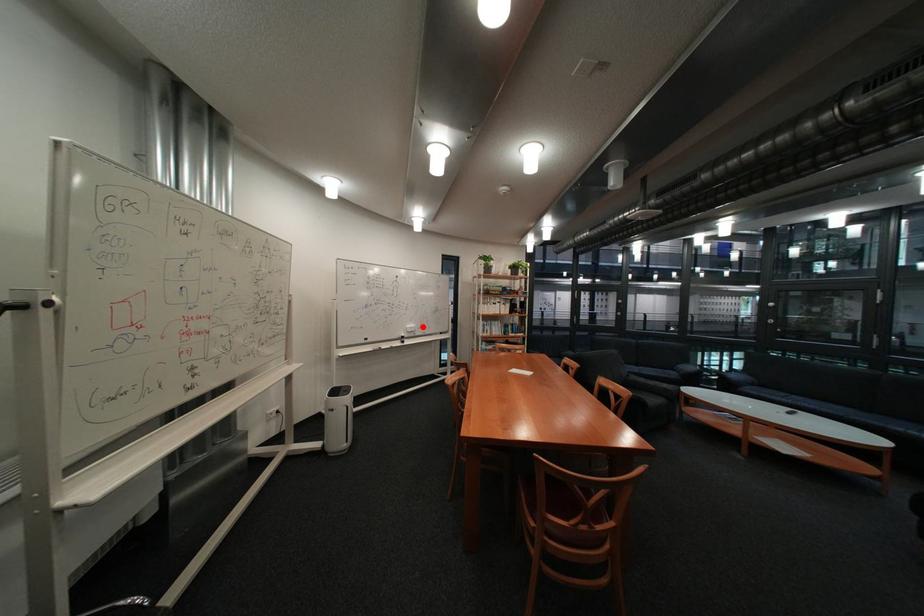
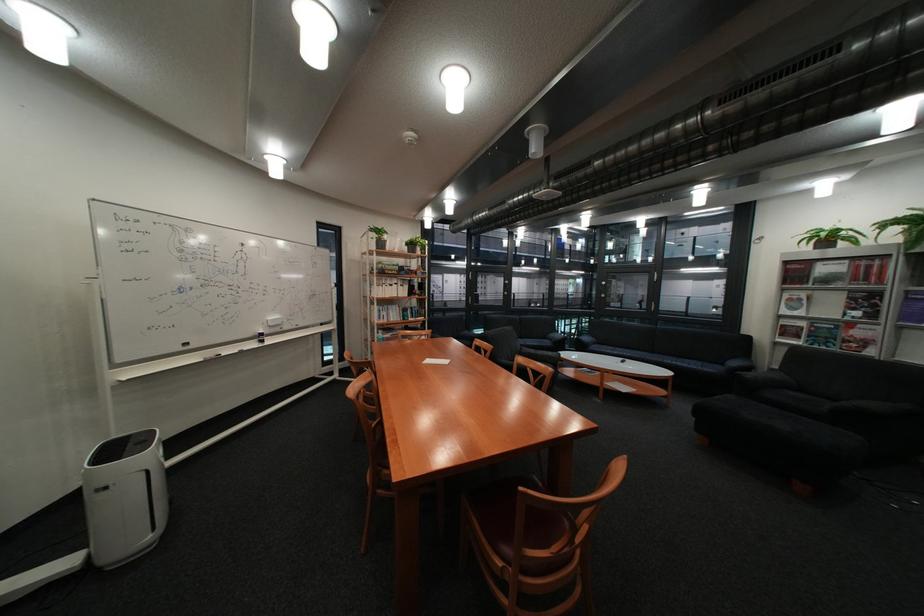
In the second image, find the point that corresponds to the highlighted location in the first image.

(284, 318)